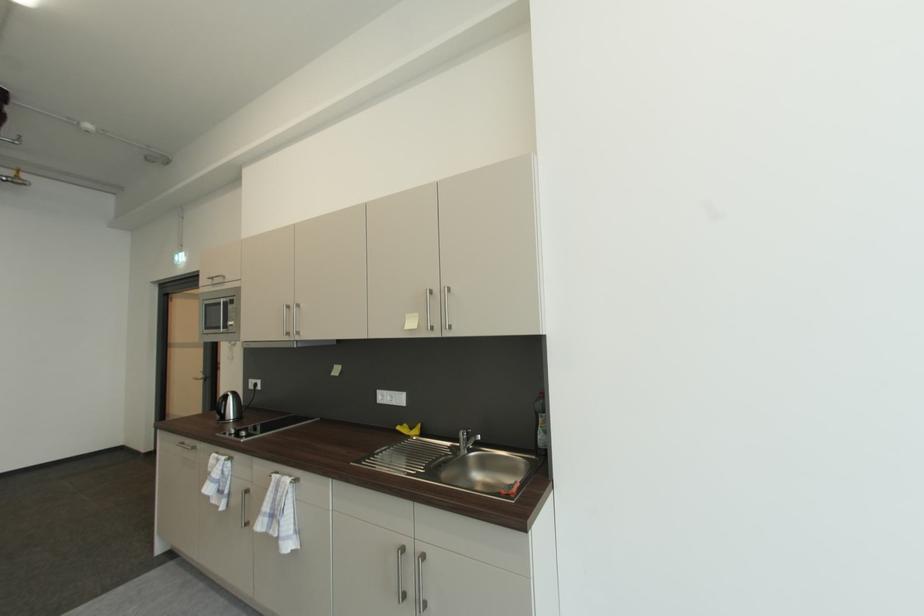
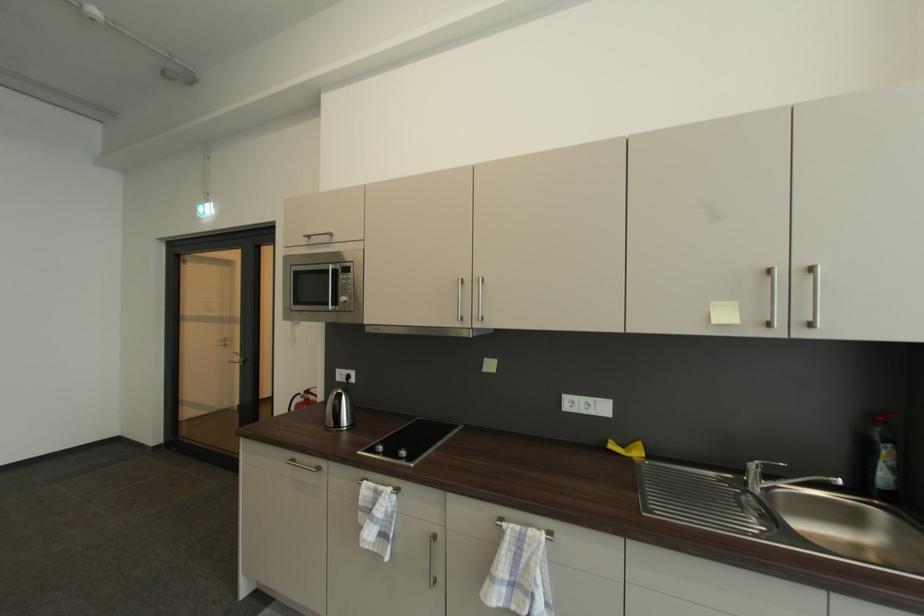
Locate, in the second image, the point that corresponds to pixel 408 427 in the first image.

(613, 443)